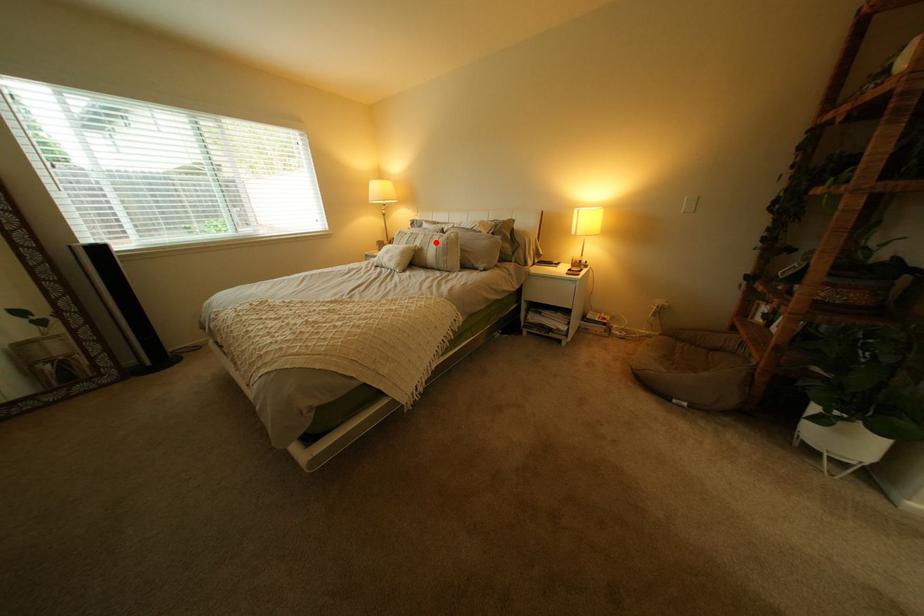
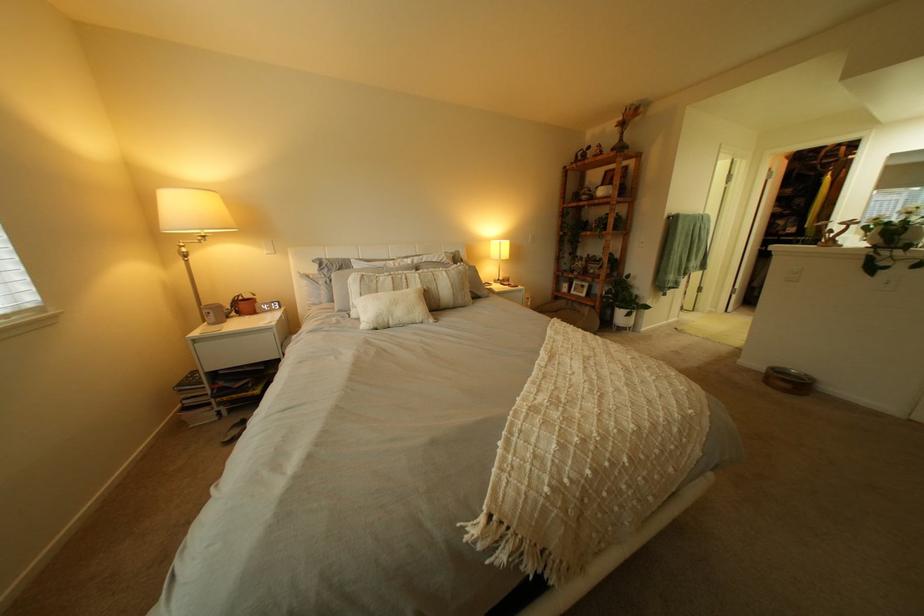
Find the pixel in the second image that matches the highlighted location in the first image.

(434, 283)